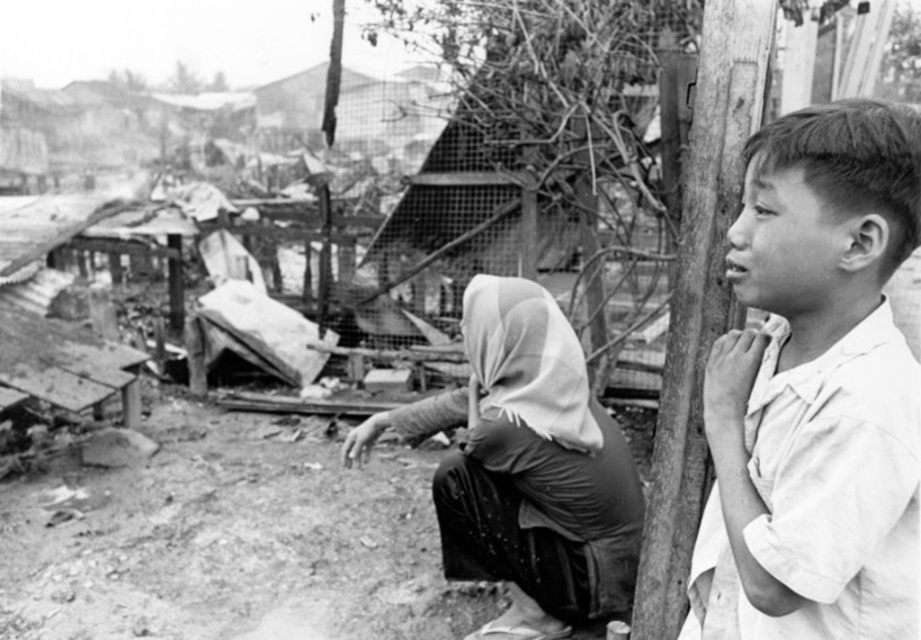
You are standing at the point with coordinates point (879,280) and want to walk to the point with coordinates point (523,305). Which direction should you move relative to the other point?

You should move towards the point (523,305), which is behind point (879,280) according to the spatial relationship provided.

You are a photographer analyzing the composition of this black and white photo. You notice the white fabric headscarf at center and the smooth wood pole at right. Which object is positioned lower in the frame?

The white fabric headscarf at center is positioned lower in the frame than the smooth wood pole at right.

In the photograph, there are two white items visible. One is the white cotton shirt at right and the other is the white fabric headscarf at center. Which of these two items takes up more visual space in the image?

The white fabric headscarf at center takes up more visual space than the white cotton shirt at right because the description states that the white cotton shirt at right occupies less space than the white fabric headscarf at center.